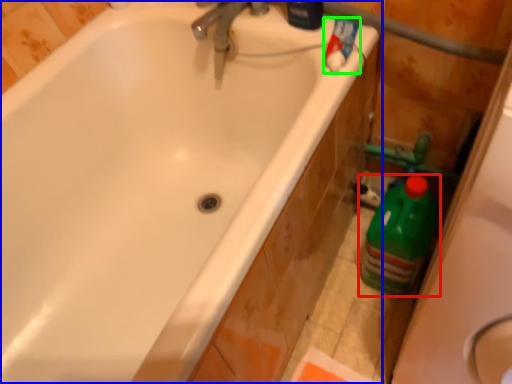
Question: Estimate the real-world distances between objects in this image. Which object is farther from cleaning product (highlighted by a red box), bathtub (highlighted by a blue box) or cleaning product (highlighted by a green box)?

Choices:
 (A) bathtub
 (B) cleaning product

Answer: (A)